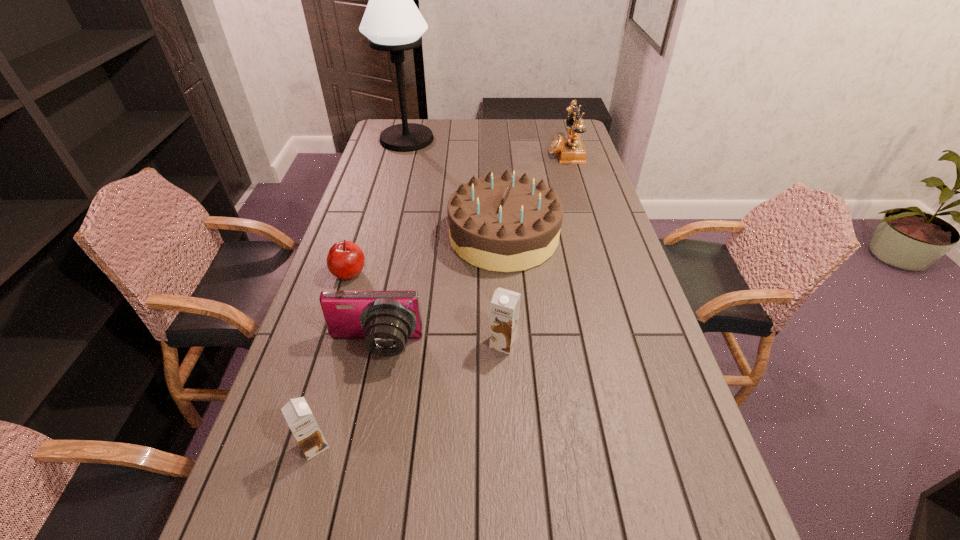
Please point a vacant point for placing a chocolate milk on the right. Please provide its 2D coordinates. Your answer should be formatted as a tuple, i.e. [(x, y)], where the tuple contains the x and y coordinates of a point satisfying the conditions above.

[(636, 272)]